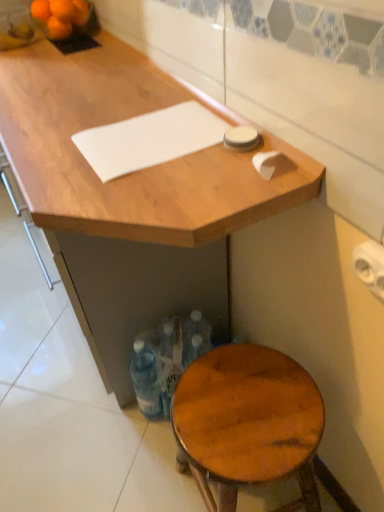
Image resolution: width=384 pixels, height=512 pixels. Find the location of `unoccupied area in front of white matte cutting board at upper center`. unoccupied area in front of white matte cutting board at upper center is located at coordinates (155, 187).